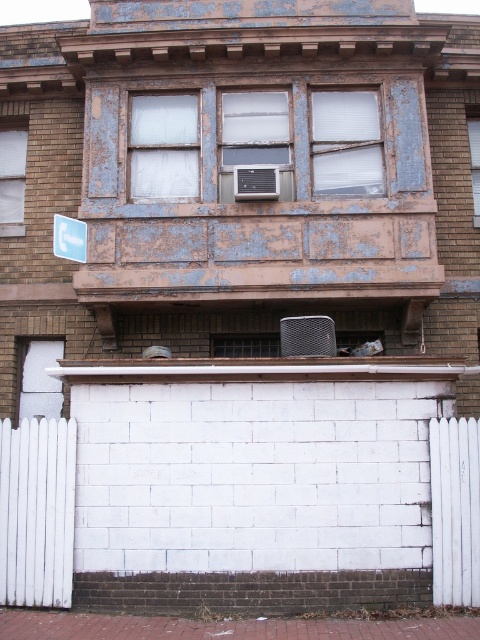
You are a window installer assessing the building. You need to replace both the white frosted glass at upper center and the clear glass window at upper center. Which of the two requires a wider replacement panel?

The white frosted glass at upper center requires a wider replacement panel because its width surpasses that of the clear glass window at upper center.

You are standing 10 meters away from the building. You want to reach the white plastic air conditioner at center to clean it. Can you reach it without moving closer than your current position?

The white plastic air conditioner at center is 11.08 meters away from the camera, so you cannot reach it without moving closer than your current position of 10 meters.